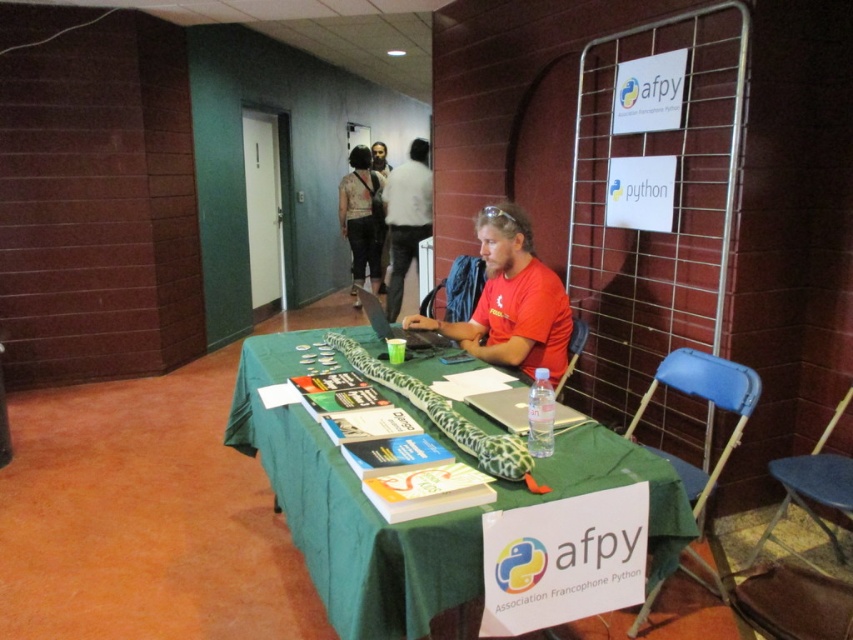
Question: Estimate the real-world distances between objects in this image. Which object is closer to the green fabric table at center?

Choices:
 (A) white textured shirt at center
 (B) matte red t-shirt at center
 (C) white matte shirt at center

Answer: (B)

Question: Does green fabric table at center appear over matte red t-shirt at center?

Choices:
 (A) no
 (B) yes

Answer: (A)

Question: Which is farther from the green fabric table at center?

Choices:
 (A) matte red t-shirt at center
 (B) white textured shirt at center

Answer: (B)

Question: Is white matte shirt at center further to the viewer compared to white textured shirt at center?

Choices:
 (A) no
 (B) yes

Answer: (A)

Question: Considering the real-world distances, which object is farthest from the green fabric table at center?

Choices:
 (A) matte red t-shirt at center
 (B) white textured shirt at center

Answer: (B)

Question: Does white matte shirt at center appear on the right side of white textured shirt at center?

Choices:
 (A) no
 (B) yes

Answer: (B)